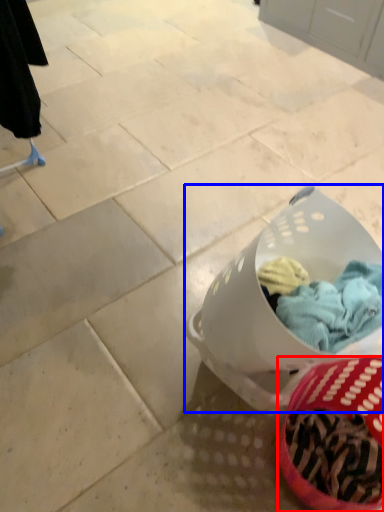
Question: Which of the following is the farthest to the observer, basket (highlighted by a red box) or laundry basket (highlighted by a blue box)?

Choices:
 (A) basket
 (B) laundry basket

Answer: (B)